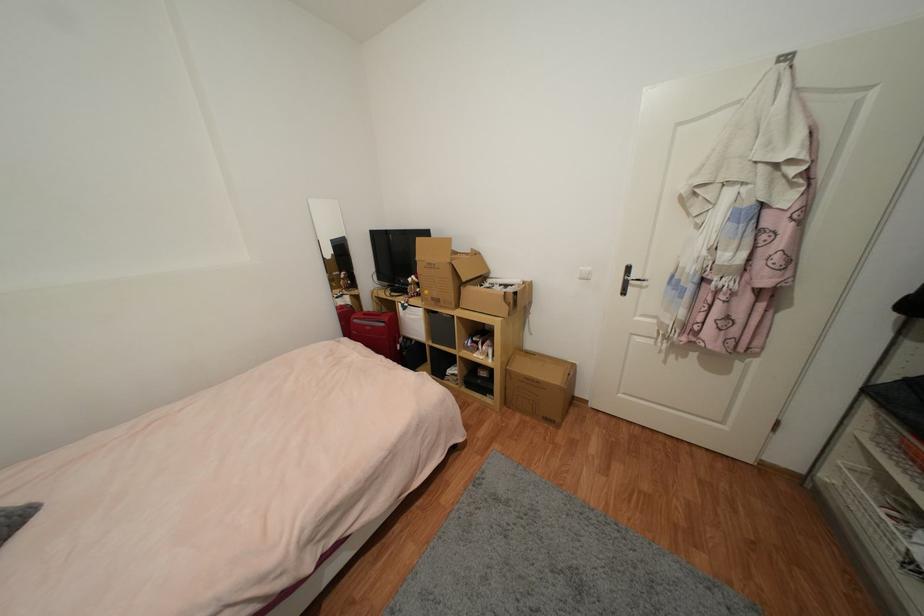
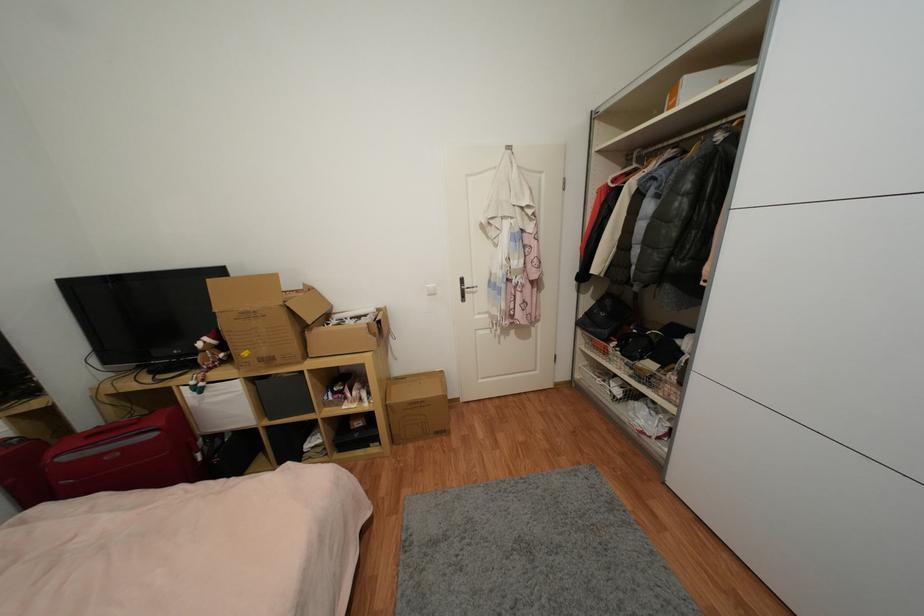
The point at (x=638, y=277) is marked in the first image. Where is the corresponding point in the second image?

(471, 286)